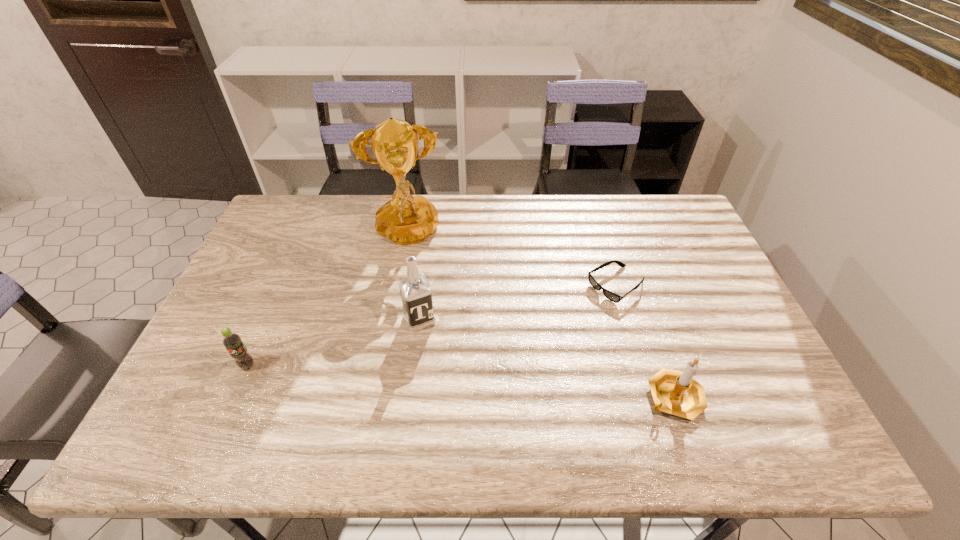
The image size is (960, 540). I want to click on free space at the near edge of the desktop, so click(x=328, y=376).

Identify the location of free location at the left edge. (280, 300).

This screenshot has width=960, height=540. In the image, there is a desktop. Find the location of `free space at the right edge`. free space at the right edge is located at coordinates (730, 308).

This screenshot has width=960, height=540. Identify the location of vacant region at the far left corner of the desktop. (286, 211).

Find the location of `vacant space that is in between the candle holder and the tallest object`. vacant space that is in between the candle holder and the tallest object is located at coordinates (540, 317).

At what (x,y) coordinates should I click in order to perform the action: click on free spot between the tallest object and the leftmost object. Please return your answer as a coordinate pair (x, y). This screenshot has width=960, height=540. Looking at the image, I should click on (326, 301).

The width and height of the screenshot is (960, 540). Identify the location of free space between the candle holder and the leftmost object. pyautogui.click(x=461, y=382).

The height and width of the screenshot is (540, 960). Find the location of `free space between the leftmost object and the candle holder`. free space between the leftmost object and the candle holder is located at coordinates (461, 382).

Find the location of a particular element. The image size is (960, 540). vacant space that is in between the leftmost object and the shortest object is located at coordinates (432, 326).

At what (x,y) coordinates should I click in order to perform the action: click on free space that is in between the soda and the candle holder. Please return your answer as a coordinate pair (x, y). Looking at the image, I should click on (461, 382).